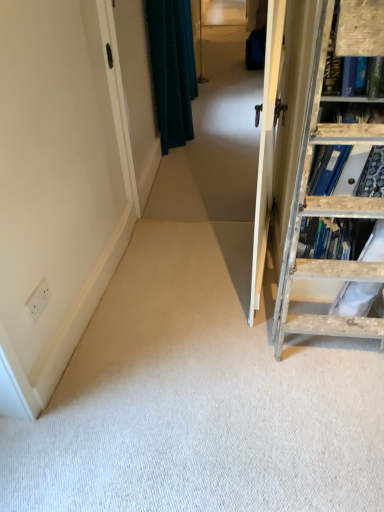
Question: Is wooden ladder at right wider or thinner than teal fabric curtain at upper left?

Choices:
 (A) wide
 (B) thin

Answer: (A)

Question: In the image, is wooden ladder at right positioned in front of or behind teal fabric curtain at upper left?

Choices:
 (A) behind
 (B) front

Answer: (B)

Question: Which is farther from the wooden ladder at right?

Choices:
 (A) teal fabric curtain at upper left
 (B) teal velvet curtain at upper center

Answer: (B)

Question: Which object is the closest to the teal velvet curtain at upper center?

Choices:
 (A) teal fabric curtain at upper left
 (B) wooden ladder at right

Answer: (A)